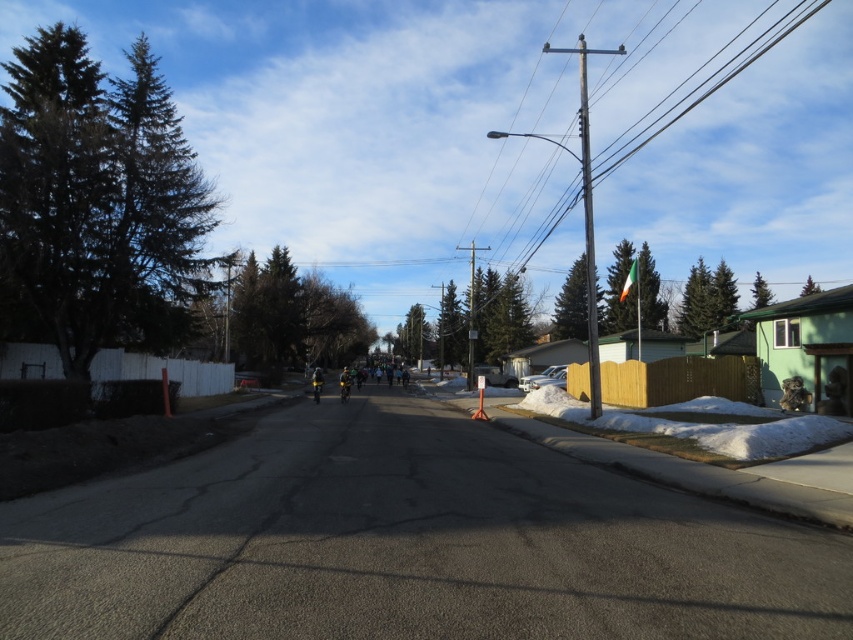
Question: Which point is closer to the camera?

Choices:
 (A) (656, 131)
 (B) (788, 449)

Answer: (B)

Question: Is white fluffy snow at lower right above metallic wire at upper center?

Choices:
 (A) yes
 (B) no

Answer: (B)

Question: Is white fluffy snow at lower right further to the viewer compared to metallic wire at upper center?

Choices:
 (A) no
 (B) yes

Answer: (A)

Question: Which of the following is the closest to the observer?

Choices:
 (A) (659, 426)
 (B) (544, 234)

Answer: (A)

Question: Can you confirm if white fluffy snow at lower right is positioned below metallic wire at upper center?

Choices:
 (A) yes
 (B) no

Answer: (A)